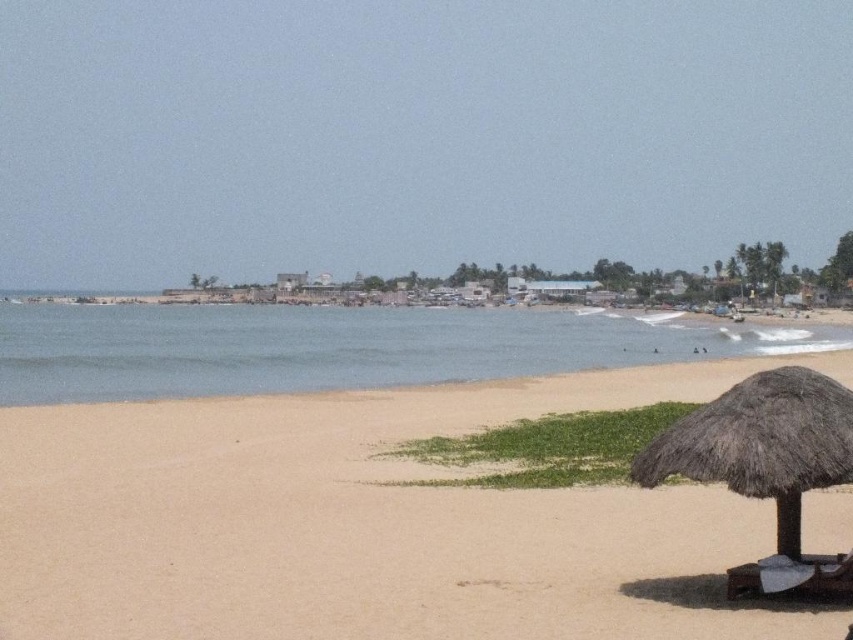
You are planning to set up a picnic on the beach. You have a picnic blanket that is 2 meters wide. You see the light brown sand at lower left and the white fabric beach chair at lower right. Which area would be suitable for placing your picnic blanket without overlapping the chair?

The light brown sand at lower left is wider than the white fabric beach chair at lower right, so placing the picnic blanket there would avoid overlapping the chair.

You are a photographer wanting to capture the white fabric beach chair at lower right and the light brown sand at lower left in the same frame. Which object will occupy more space in the photo?

The light brown sand at lower left will occupy more space in the photo because it is larger in size than the white fabric beach chair at lower right.

You are standing on the beach and want to walk from the blue water at center to the thatched straw umbrella at lower right. In which direction should you head?

You should head to the right because the blue water at center is positioned on the left side of the thatched straw umbrella at lower right, so moving right will lead you towards the umbrella.